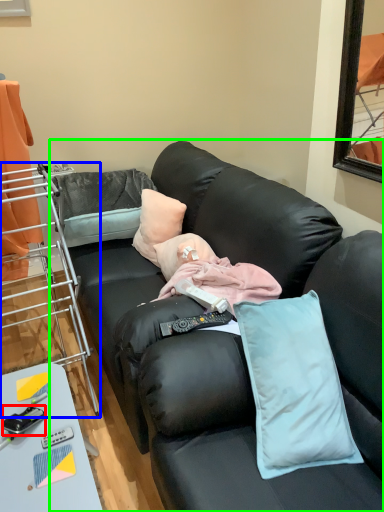
Question: Estimate the real-world distances between objects in this image. Which object is closer to equipment (highlighted by a red box), cabinetry (highlighted by a blue box) or studio couch (highlighted by a green box)?

Choices:
 (A) cabinetry
 (B) studio couch

Answer: (B)